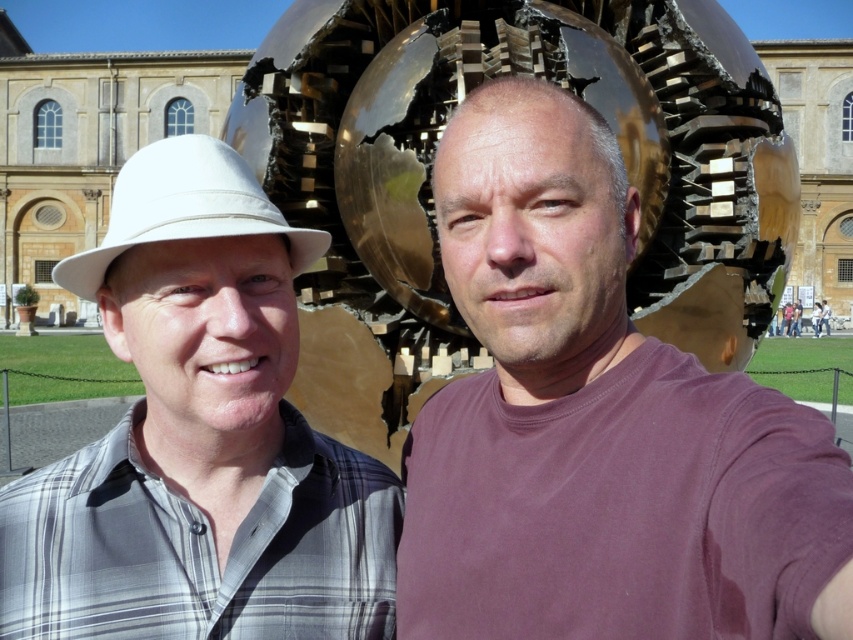
Question: Among these points, which one is nearest to the camera?

Choices:
 (A) (791, 314)
 (B) (450, 42)

Answer: (B)

Question: Which point is closer to the camera taking this photo?

Choices:
 (A) (820, 308)
 (B) (567, 12)

Answer: (B)

Question: Is matte purple shirt at center smaller than white fabric baseball hat at left?

Choices:
 (A) yes
 (B) no

Answer: (B)

Question: Does white matte hat at left come in front of matte white hat at upper left?

Choices:
 (A) no
 (B) yes

Answer: (B)

Question: Can you confirm if white matte hat at left is thinner than white fabric baseball hat at left?

Choices:
 (A) yes
 (B) no

Answer: (B)

Question: Which point appears farthest from the camera in this image?

Choices:
 (A) (196, 541)
 (B) (450, 147)
 (C) (270, 104)
 (D) (213, 150)

Answer: (C)